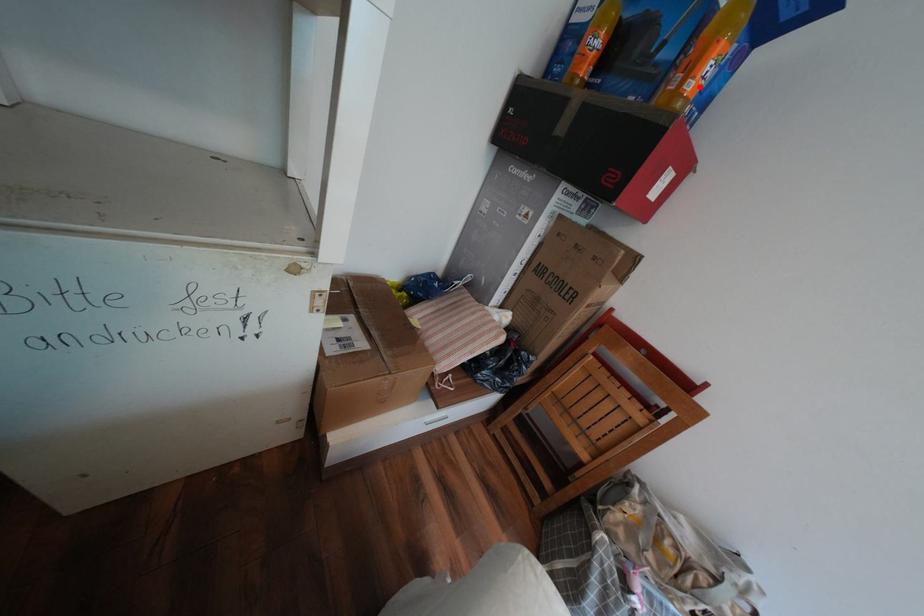
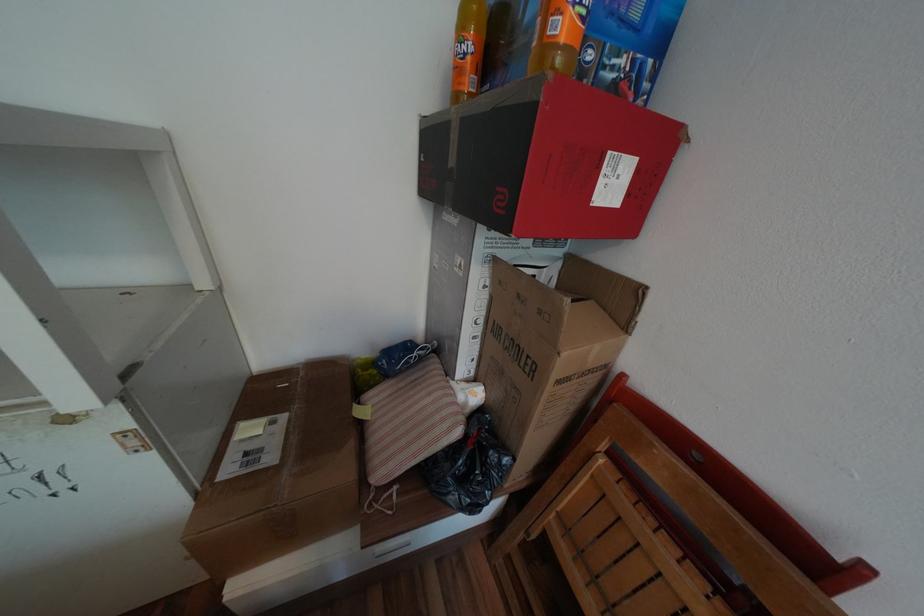
Find the pixel in the second image that matches the highlighted location in the first image.

(569, 26)